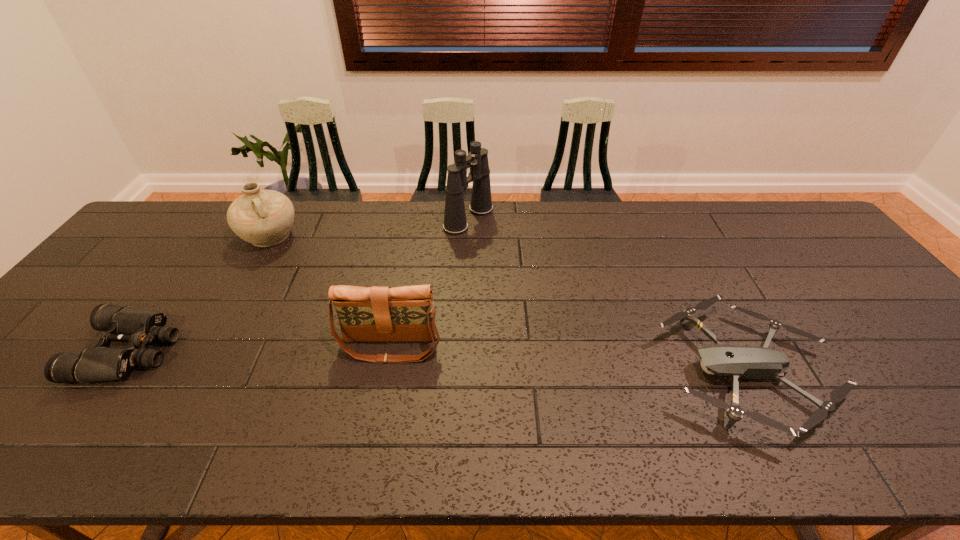
At what (x,y) coordinates should I click in order to perform the action: click on vacant point located between the rightmost object and the pottery. Please return your answer as a coordinate pair (x, y). Looking at the image, I should click on pos(509,303).

Find the location of a particular element. free space between the shortest object and the taller binoculars is located at coordinates (608, 294).

Where is `the second closest object relative to the shoulder bag`? the second closest object relative to the shoulder bag is located at coordinates (455, 223).

Identify which object is the third closest to the fourth tallest object. Please provide its 2D coordinates. Your answer should be formatted as a tuple, i.e. [(x, y)], where the tuple contains the x and y coordinates of a point satisfying the conditions above.

[(455, 223)]

Identify the location of vacant area that satisfies the following two spatial constraints: 1. on the back side of the pottery; 2. on the right side of the farther binoculars. The image size is (960, 540). (280, 219).

Locate an element on the screen. Image resolution: width=960 pixels, height=540 pixels. vacant area in the image that satisfies the following two spatial constraints: 1. on the front-facing side of the shoulder bag; 2. through the eyepieces of the shorter binoculars is located at coordinates (389, 350).